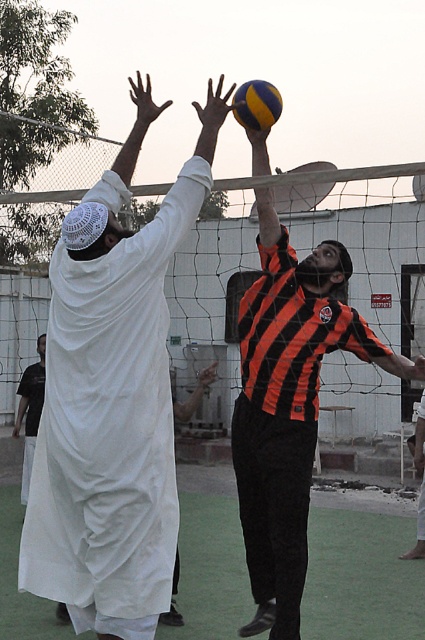
Question: Which point appears farthest from the camera in this image?

Choices:
 (A) (149, 492)
 (B) (30, 413)

Answer: (B)

Question: Does orange striped shirt at upper center have a smaller size compared to yellowmaterial/texturevolleyball at upper center?

Choices:
 (A) yes
 (B) no

Answer: (B)

Question: Estimate the real-world distances between objects in this image. Which object is closer to the white cloth at upper left?

Choices:
 (A) yellowmaterial/texturevolleyball at upper center
 (B) orange striped shirt at upper center
 (C) white clothed person at upper left

Answer: (B)

Question: Is white clothed person at upper left to the right of yellowmaterial/texturevolleyball at upper center from the viewer's perspective?

Choices:
 (A) yes
 (B) no

Answer: (B)

Question: Which object appears farthest from the camera in this image?

Choices:
 (A) yellowmaterial/texturevolleyball at upper center
 (B) white cloth at upper left
 (C) orange striped shirt at upper center
 (D) white clothed person at upper left

Answer: (B)

Question: Does white clothed person at upper left appear on the left side of yellowmaterial/texturevolleyball at upper center?

Choices:
 (A) no
 (B) yes

Answer: (B)